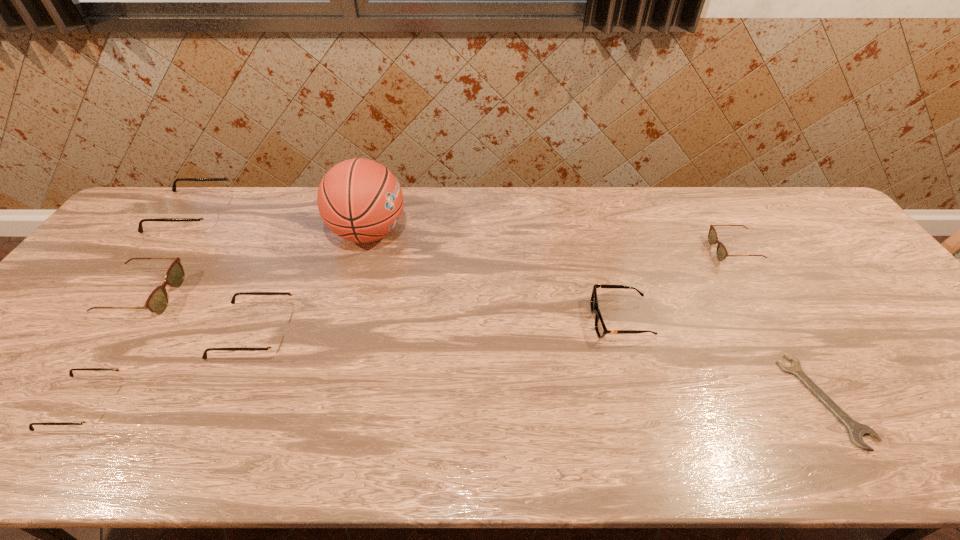
Identify the location of object present at the far left corner. (210, 218).

Locate an element on the screen. This screenshot has height=540, width=960. vacant region at the far edge of the desktop is located at coordinates (316, 218).

The image size is (960, 540). I want to click on vacant space at the near edge of the desktop, so click(x=707, y=450).

Where is `vacant area at the left edge of the desktop`? This screenshot has height=540, width=960. vacant area at the left edge of the desktop is located at coordinates (139, 279).

This screenshot has width=960, height=540. Identify the location of vacant space at the right edge of the desktop. (875, 328).

Identify the location of free region at the far left corner. Image resolution: width=960 pixels, height=540 pixels. (195, 187).

Image resolution: width=960 pixels, height=540 pixels. In the image, there is a desktop. Identify the location of vacant space at the far right corner. (804, 229).

At what (x,y) coordinates should I click in order to perform the action: click on free space between the farther brown spectacles and the farthest black spectacles. Please return your answer as a coordinate pair (x, y). Looking at the image, I should click on (464, 233).

At what (x,y) coordinates should I click in order to perform the action: click on free space between the farther brown spectacles and the wrench. Please return your answer as a coordinate pair (x, y). Image resolution: width=960 pixels, height=540 pixels. Looking at the image, I should click on (779, 325).

Find the location of a particular element. This screenshot has width=960, height=540. vacant area between the farther brown spectacles and the second smallest black spectacles is located at coordinates (494, 292).